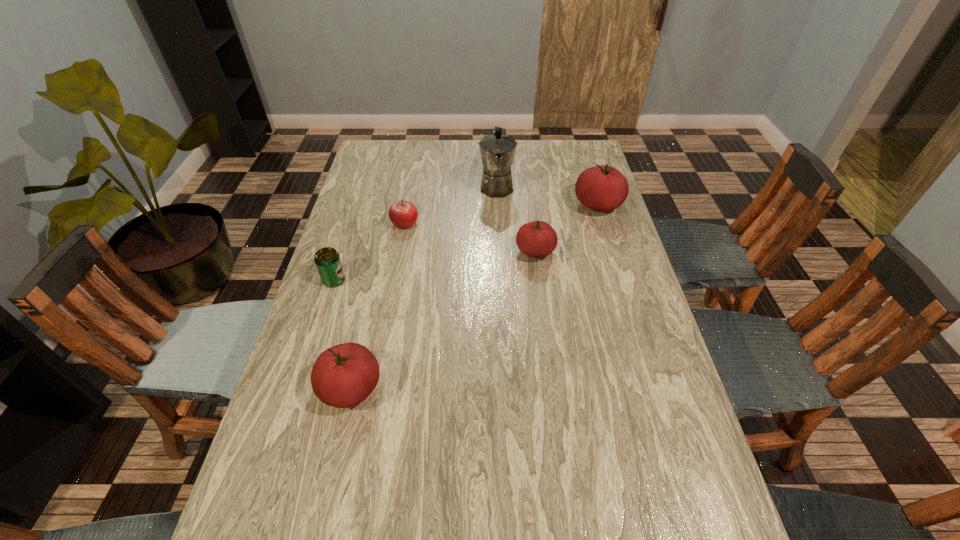
This screenshot has width=960, height=540. I want to click on free spot that satisfies the following two spatial constraints: 1. on the back side of the fourth farthest object; 2. on the right side of the rightmost object, so click(x=529, y=205).

Identify the location of vacant region that satisfies the following two spatial constraints: 1. on the pouring side of the coffeepot; 2. on the right side of the farthest tomato. (497, 205).

Find the location of a particular element. The image size is (960, 540). free point that satisfies the following two spatial constraints: 1. on the pouring side of the third nearest object; 2. on the right side of the coffeepot is located at coordinates (499, 252).